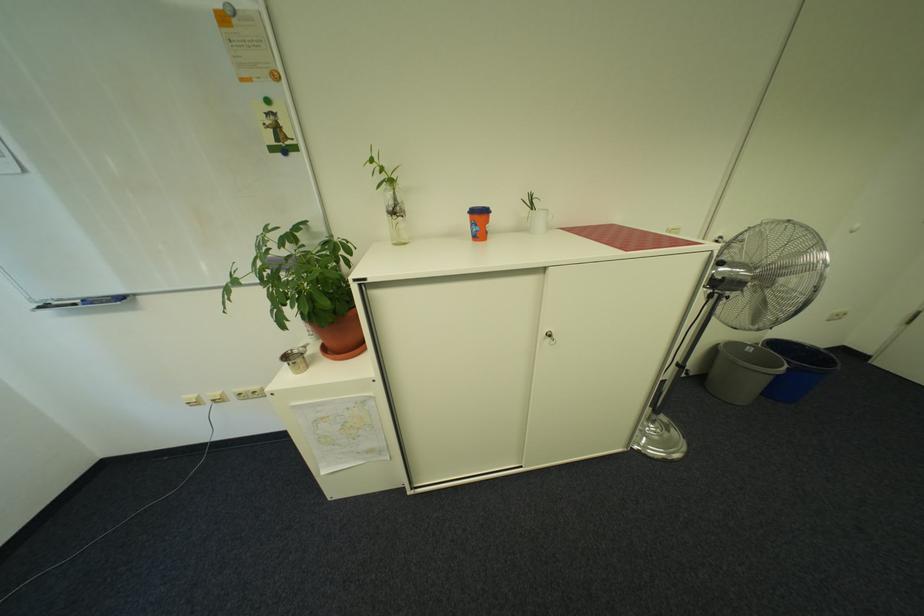
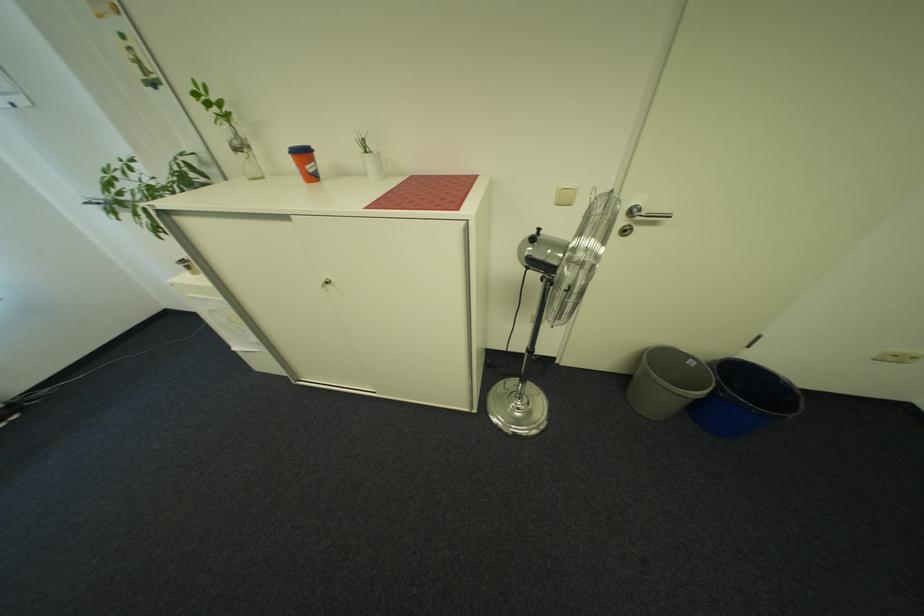
In the second image, find the point that corresponds to [541,211] in the first image.

(375, 153)